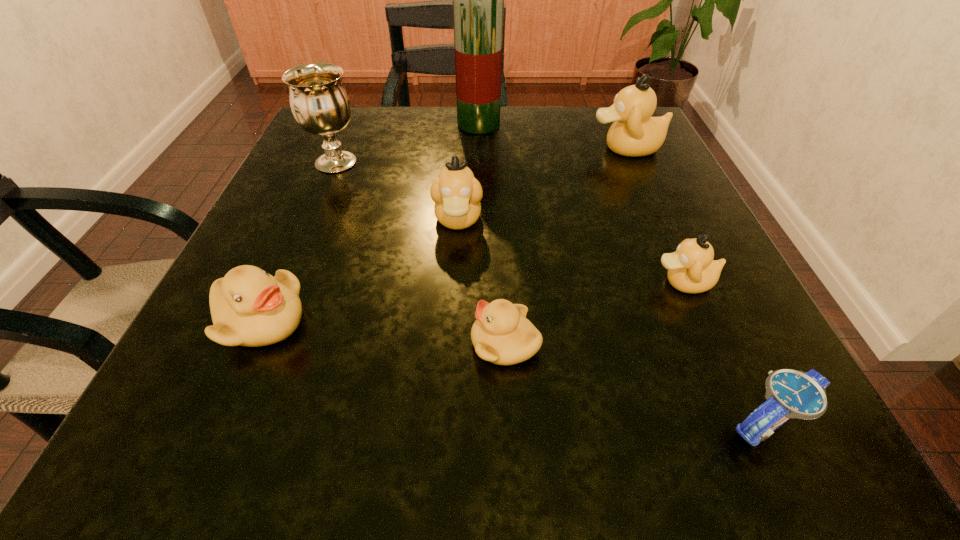
Where is `green liquor`? green liquor is located at coordinates (478, 0).

Identify the location of the tallest object. This screenshot has height=540, width=960. (478, 0).

You are a GUI agent. You are given a task and a screenshot of the screen. Output one action in this format:
    pyautogui.click(x=<x>, y=<y>)
    Task: Click on the chalice
    The image size is (960, 540).
    Given the screenshot: What is the action you would take?
    pyautogui.click(x=320, y=104)

Find the location of a particular element. The image size is (960, 540). the farthest duckling is located at coordinates (634, 132).

In order to click on the farthest tan duckling in this screenshot , I will do `click(634, 132)`.

I want to click on the fourth tallest object, so click(456, 192).

Identify the location of the second farthest duckling. The image size is (960, 540). (456, 192).

Locate an element on the screen. This screenshot has width=960, height=540. the leftmost duckling is located at coordinates [249, 307].

The width and height of the screenshot is (960, 540). Find the location of `the left yellow duckling`. the left yellow duckling is located at coordinates (249, 307).

At what (x,y) coordinates should I click in order to perform the action: click on the nearest tan duckling. Please return your answer as a coordinate pair (x, y). This screenshot has width=960, height=540. Looking at the image, I should click on (691, 269).